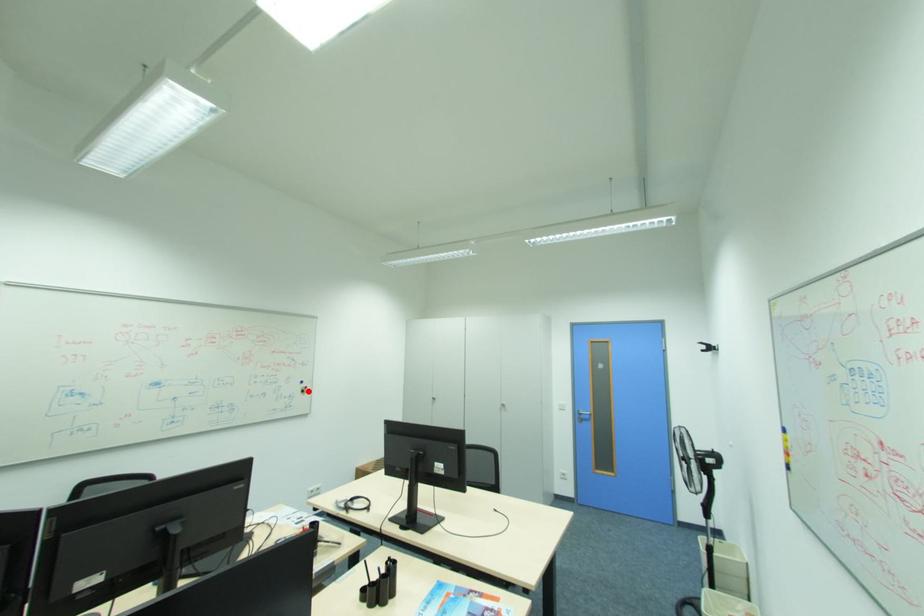
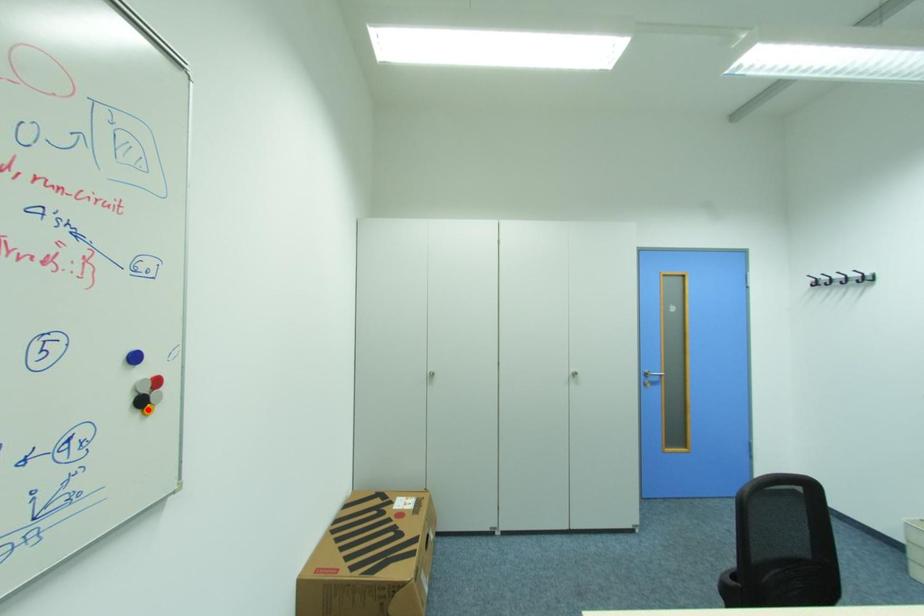
I am providing you with two images of the same scene from different viewpoints. A red point is marked on the first image and another point is marked on the second image. Does the point marked in image1 correspond to the same location as the one in image2?

No